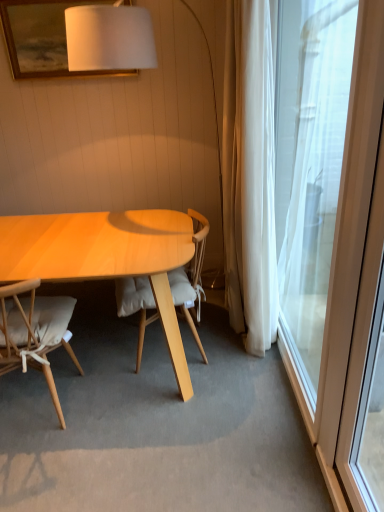
Locate an element on the screen. The width and height of the screenshot is (384, 512). free spot to the right of light brown wood chair at left, acting as the first chair starting from the left is located at coordinates (120, 414).